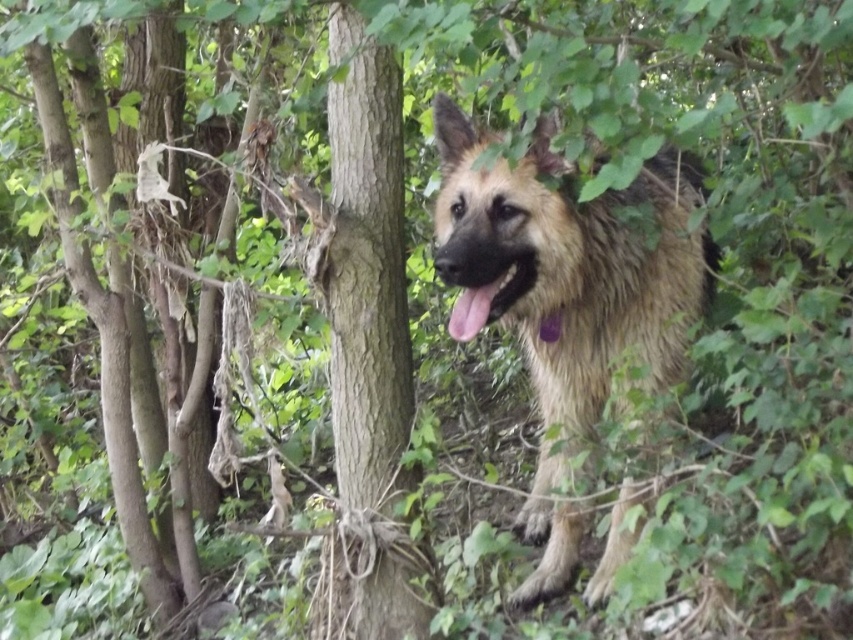
Can you confirm if fuzzy brown dog at center is positioned to the left of black glossy tongue at center?

In fact, fuzzy brown dog at center is to the right of black glossy tongue at center.

Is point (527, 342) farther from camera compared to point (502, 285)?

Yes, point (527, 342) is farther from viewer.

Who is more forward, (462, 317) or (492, 282)?

Positioned in front is point (462, 317).

Where is `fuzzy brown dog at center`? fuzzy brown dog at center is located at coordinates (567, 266).